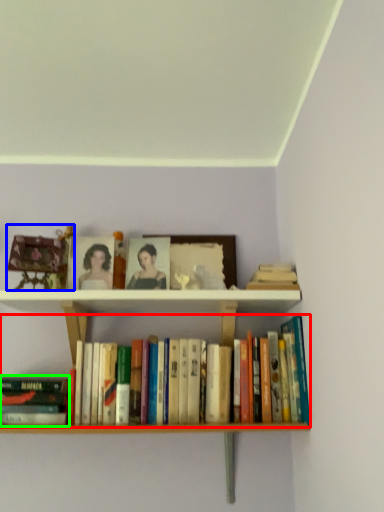
Question: Which object is positioned closest to book (highlighted by a red box)? Select from toy (highlighted by a blue box) and book (highlighted by a green box).

Choices:
 (A) toy
 (B) book

Answer: (B)